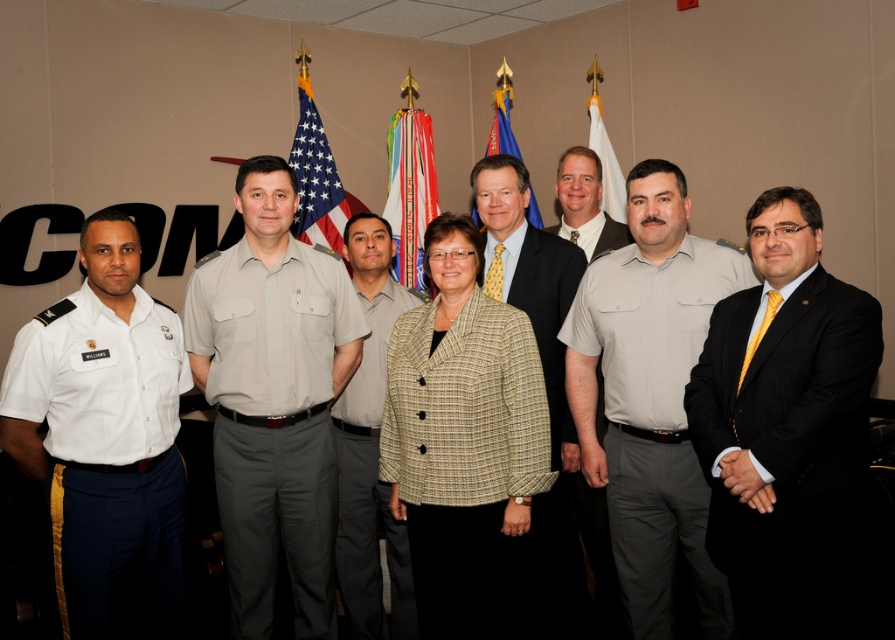
Which of these two, white fabric flag at center or blue fabric flag at center, stands shorter?

With less height is white fabric flag at center.

This screenshot has width=895, height=640. Identify the location of white fabric flag at center. (606, 164).

In the scene shown: Can you confirm if black pinstripe suit at right is wider than light gray uniform at center?

No.

Can you confirm if black pinstripe suit at right is positioned above light gray uniform at center?

Incorrect, black pinstripe suit at right is not positioned above light gray uniform at center.

You are a GUI agent. You are given a task and a screenshot of the screen. Output one action in this format:
    pyautogui.click(x=<x>, y=<y>)
    Task: Click on the black pinstripe suit at right
    
    Given the screenshot: What is the action you would take?
    pyautogui.click(x=791, y=456)

Who is positioned more to the left, black pinstripe suit at right or khaki uniform pants at center?

khaki uniform pants at center

Can you confirm if black pinstripe suit at right is shorter than khaki uniform pants at center?

Indeed, black pinstripe suit at right has a lesser height compared to khaki uniform pants at center.

You are a GUI agent. You are given a task and a screenshot of the screen. Output one action in this format:
    pyautogui.click(x=<x>, y=<y>)
    Task: Click on the black pinstripe suit at right
    
    Given the screenshot: What is the action you would take?
    pyautogui.click(x=791, y=456)

At what (x,y) coordinates should I click in order to perform the action: click on black pinstripe suit at right. Please return your answer as a coordinate pair (x, y). Image resolution: width=895 pixels, height=640 pixels. Looking at the image, I should click on (791, 456).